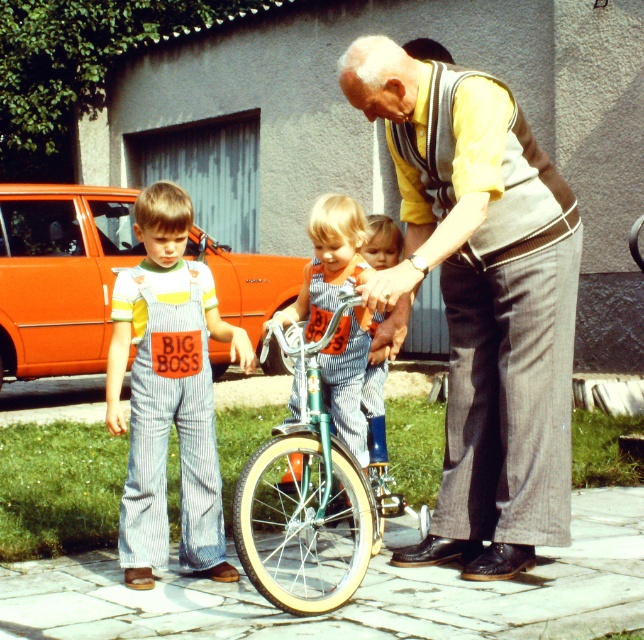
Which is above, denim overalls at center or green metallic bicycle at center?

denim overalls at center is higher up.

Is denim overalls at center closer to camera compared to green metallic bicycle at center?

No, it is not.

I want to click on denim overalls at center, so click(167, 392).

Where is `denim overalls at center`? denim overalls at center is located at coordinates (167, 392).

Can you confirm if yellow striped vest at center is thinner than striped denim overalls at center?

Incorrect, yellow striped vest at center's width is not less than striped denim overalls at center's.

Does yellow striped vest at center appear under striped denim overalls at center?

No.

Which is behind, point (515, 182) or point (325, 282)?

Point (325, 282)

Identify the location of yellow striped vest at center. (480, 300).

From the picture: Can you confirm if yellow striped vest at center is taller than denim overalls at center?

Correct, yellow striped vest at center is much taller as denim overalls at center.

Based on the photo, who is more distant from viewer, [536,440] or [117,330]?

The point [117,330] is more distant.

Find the location of a particular element. The width and height of the screenshot is (644, 640). yellow striped vest at center is located at coordinates (480, 300).